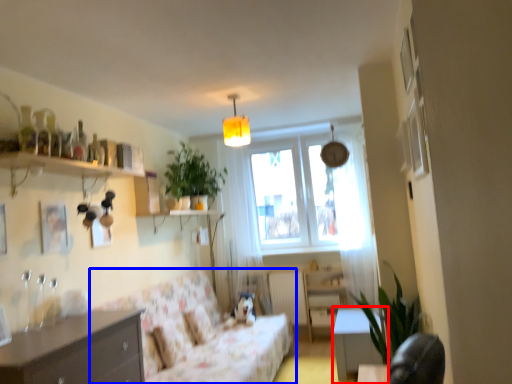
Question: Which object appears closest to the camera in this image, table (highlighted by a red box) or studio couch (highlighted by a blue box)?

Choices:
 (A) table
 (B) studio couch

Answer: (B)